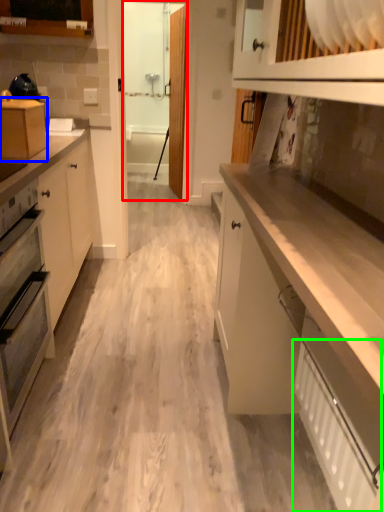
Question: Based on their relative distances, which object is nearer to glass door (highlighted by a red box)? Choose from cabinetry (highlighted by a blue box) and radiator (highlighted by a green box).

Choices:
 (A) cabinetry
 (B) radiator

Answer: (A)